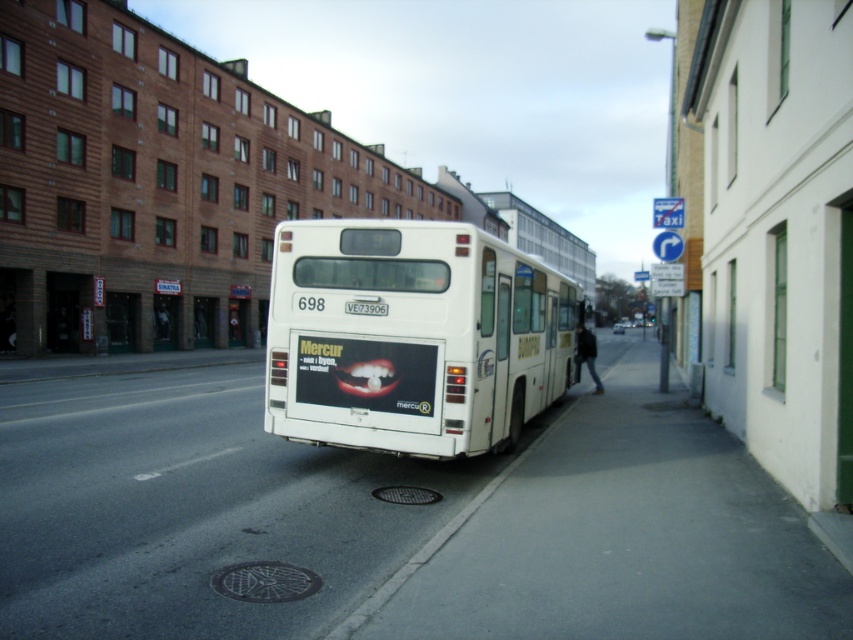
You are standing at the point marked by coordinates (x=412, y=337) in the image. What object is exactly at this location?

The white matte bus at center is located at point (x=412, y=337).

You are a delivery person who needs to unload a package from your truck parked 28 feet away from the white matte bus at center. Can you safely reach the bus without moving your truck?

The distance between your truck and the white matte bus at center is 28.01 feet, which is slightly more than the 28 feet you mentioned. Therefore, you would need to move your truck closer to safely reach the bus.

From the picture: You are a delivery person who needs to attach a small package to the white matte bus at center. Considering the size of the white plastic license plate at rear, will the package fit on the license plate itself?

The white matte bus at center is larger than the white plastic license plate at rear, so the package can fit on the license plate since the license plate is smaller than the bus.